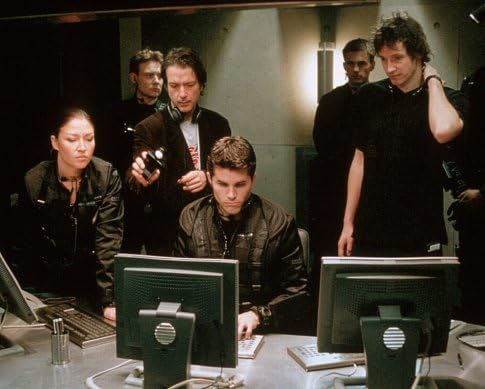
You are a GUI agent. You are given a task and a screenshot of the screen. Output one action in this format:
    pyautogui.click(x=<x>, y=<y>)
    Task: Click on the pen
    The image size is (485, 389).
    Given the screenshot: What is the action you would take?
    pyautogui.click(x=461, y=360)